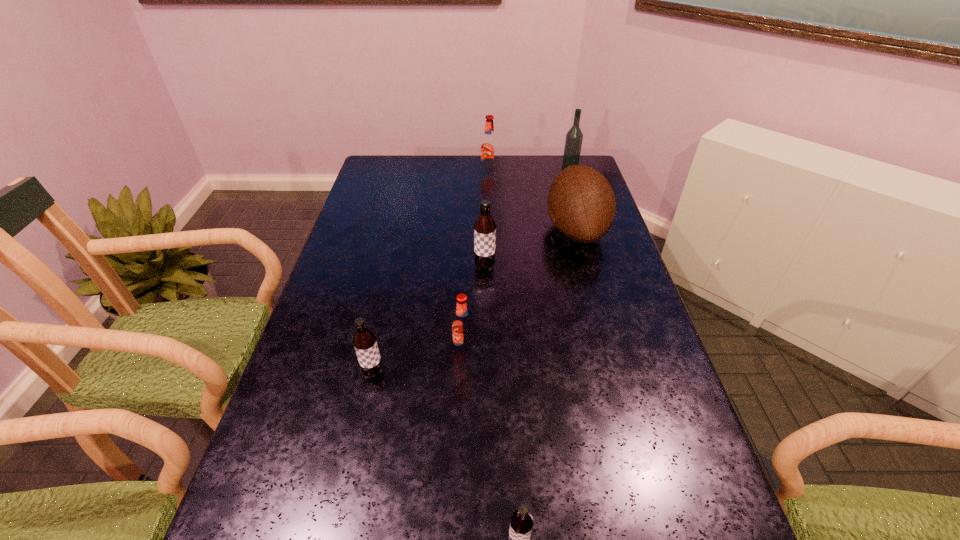
Find the location of a particular element. The height and width of the screenshot is (540, 960). object at the left edge is located at coordinates [364, 341].

The width and height of the screenshot is (960, 540). I want to click on vodka located at the right edge, so click(x=574, y=137).

Locate an element on the screen. The width and height of the screenshot is (960, 540). football at the right edge is located at coordinates (581, 203).

Image resolution: width=960 pixels, height=540 pixels. I want to click on object located at the far right corner, so click(x=574, y=137).

I want to click on free point at the far edge, so click(x=548, y=175).

In the image, there is a desktop. Identify the location of blank space at the left edge. This screenshot has width=960, height=540. [398, 221].

This screenshot has height=540, width=960. Identify the location of vacant area at the right edge. (704, 478).

In the image, there is a desktop. At what (x,y) coordinates should I click in order to perform the action: click on vacant space at the far left corner. Please return your answer as a coordinate pair (x, y). Image resolution: width=960 pixels, height=540 pixels. Looking at the image, I should click on (411, 169).

The height and width of the screenshot is (540, 960). Identify the location of vacant point located between the farthest brown root beer and the leftmost root beer. click(429, 321).

Image resolution: width=960 pixels, height=540 pixels. Identify the location of vacant point located between the right red root beer and the black vodka. (529, 171).